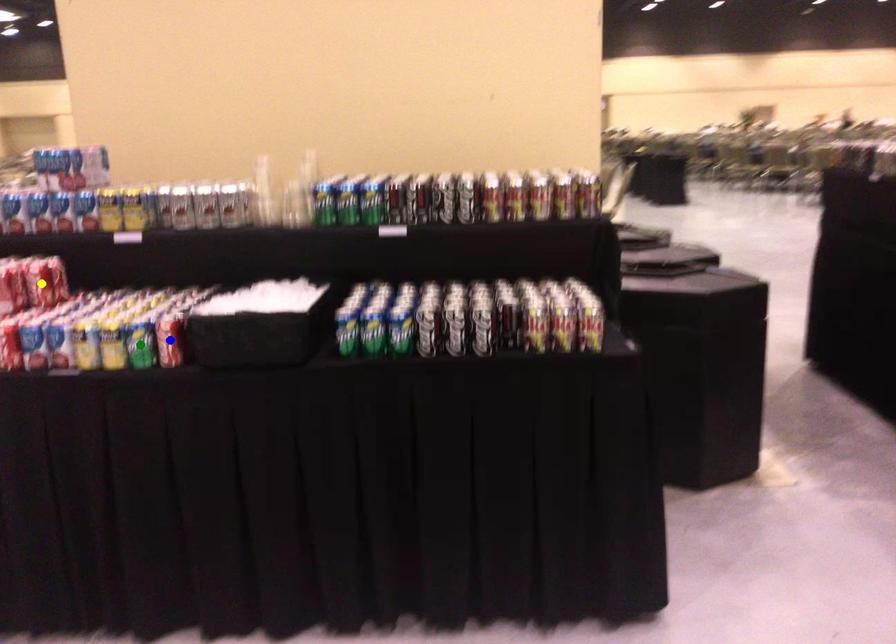
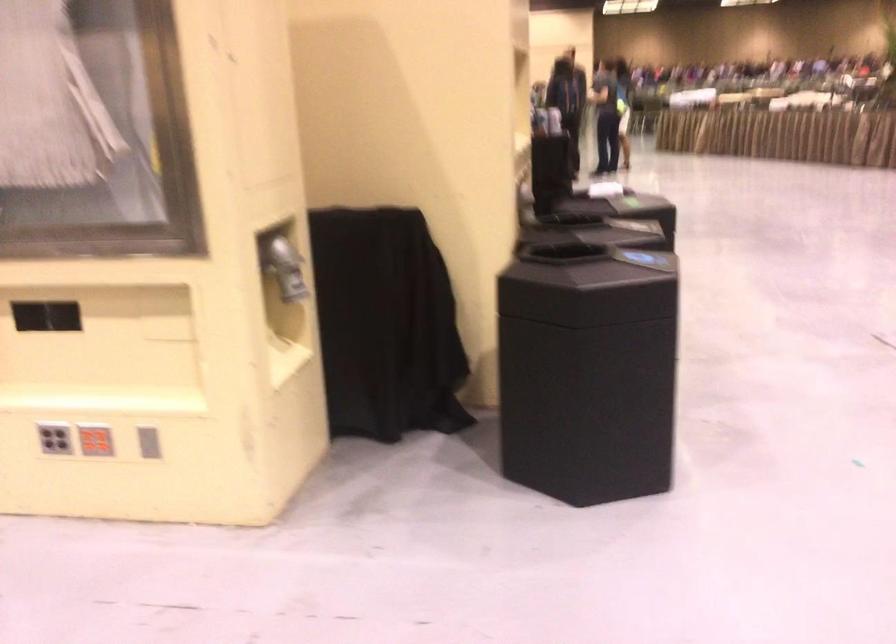
I am providing you with two images of the same scene from different viewpoints. Three points are marked in image1. Which point corresponds to a part or object that is occluded in image2?In image1, three points are marked. Which of them correspond to a part or object that is occluded in image2?Among the three points shown in image1, which one corresponds to a part or object that is no longer visible due to occlusion in image2?

Invisible in image2: blue point, yellow point, green point.